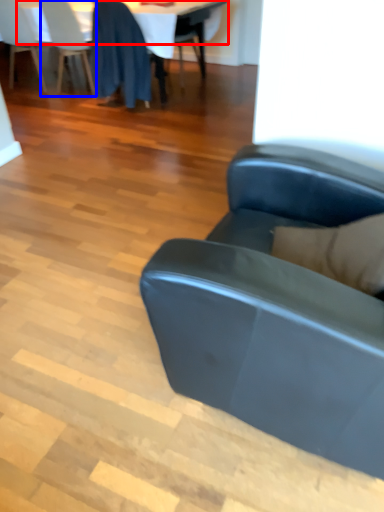
Question: Which point is closer to the camera, table top (highlighted by a red box) or chair (highlighted by a blue box)?

Choices:
 (A) table top
 (B) chair

Answer: (A)